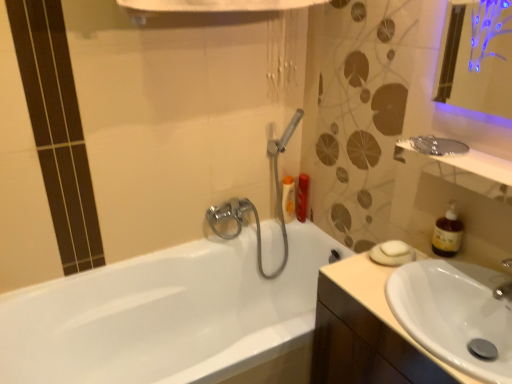
Where is `free spot above metallic silver mirror at upper right (from a real-world perspective)`? The height and width of the screenshot is (384, 512). free spot above metallic silver mirror at upper right (from a real-world perspective) is located at coordinates (476, 162).